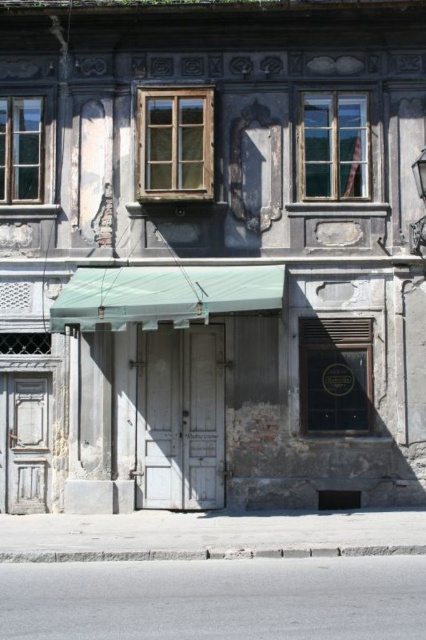
Consider the image. Can you confirm if green fabric awning at center is wider than gray concrete curb at lower center?

No.

Can you confirm if green fabric awning at center is positioned below gray concrete curb at lower center?

No.

Locate an element on the screen. This screenshot has width=426, height=640. green fabric awning at center is located at coordinates (164, 294).